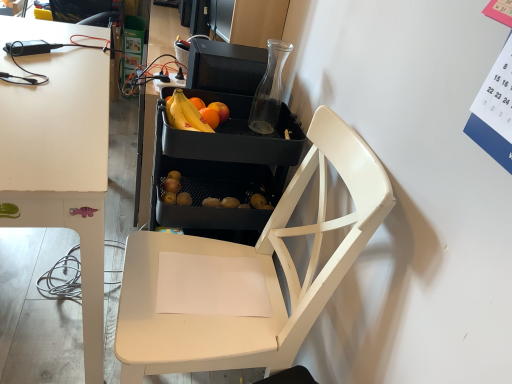
Question: Relative to matte black fruit at center, is white matte desk at left in front or behind?

Choices:
 (A) front
 (B) behind

Answer: (A)

Question: Is white matte desk at left situated inside matte black fruit at center or outside?

Choices:
 (A) inside
 (B) outside

Answer: (B)

Question: Which object is positioned farthest from the white matte desk at left?

Choices:
 (A) matte black fruit at center
 (B) black plastic tray at center
 (C) white matte chair at center

Answer: (C)

Question: Which of these objects is positioned closest to the white matte desk at left?

Choices:
 (A) matte black fruit at center
 (B) black plastic tray at center
 (C) white matte chair at center

Answer: (A)